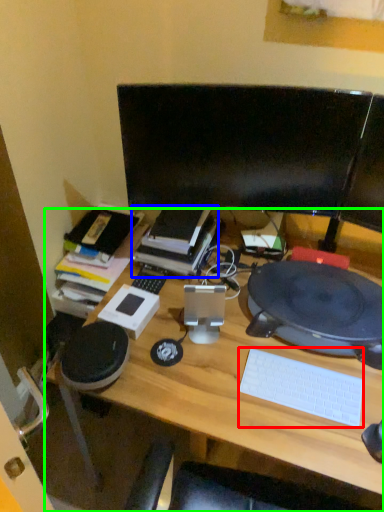
Question: Which object is positioned farthest from computer keyboard (highlighted by a red box)? Select from book (highlighted by a blue box) and desk (highlighted by a green box).

Choices:
 (A) book
 (B) desk

Answer: (A)